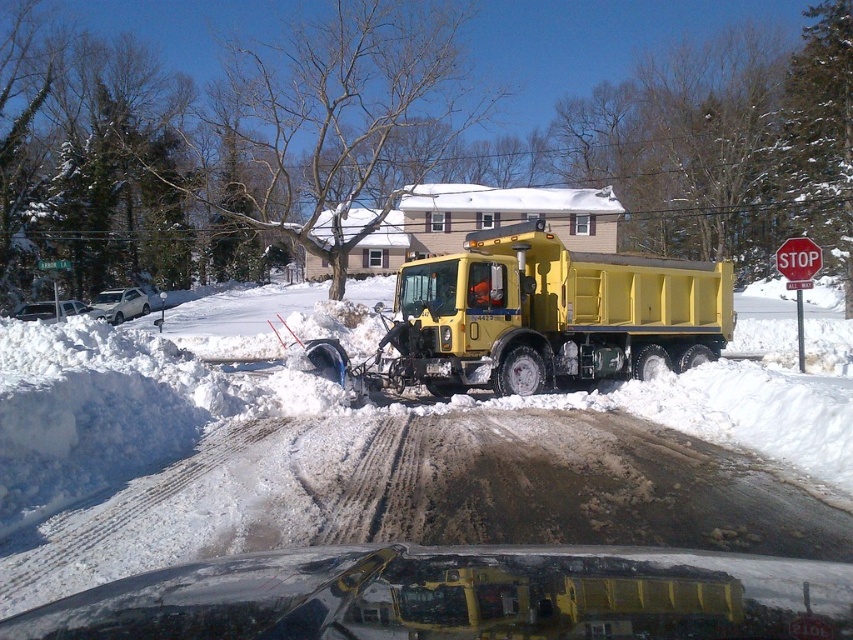
Which is in front, point (761, 500) or point (792, 250)?

Point (761, 500) is more forward.

Who is more distant from viewer, (x=25, y=442) or (x=782, y=256)?

The point (x=782, y=256) is behind.

Locate an element on the screen. Image resolution: width=853 pixels, height=640 pixels. white fluffy snow at center is located at coordinates (387, 456).

Which is more to the right, yellow matte/snowplow at center or red plastic stop sign at upper right?

From the viewer's perspective, red plastic stop sign at upper right appears more on the right side.

Can you confirm if yellow matte/snowplow at center is thinner than red plastic stop sign at upper right?

Yes.

What are the coordinates of `yellow matte/snowplow at center` in the screenshot? It's located at (550, 314).

Which is above, white fluffy snow at center or yellow matte/snowplow at center?

yellow matte/snowplow at center is higher up.

Can you confirm if white fluffy snow at center is positioned to the left of yellow matte/snowplow at center?

Indeed, white fluffy snow at center is positioned on the left side of yellow matte/snowplow at center.

Between point (392, 531) and point (579, 368), which one is positioned behind?

Positioned behind is point (579, 368).

Locate an element on the screen. Image resolution: width=853 pixels, height=640 pixels. white fluffy snow at center is located at coordinates (387, 456).